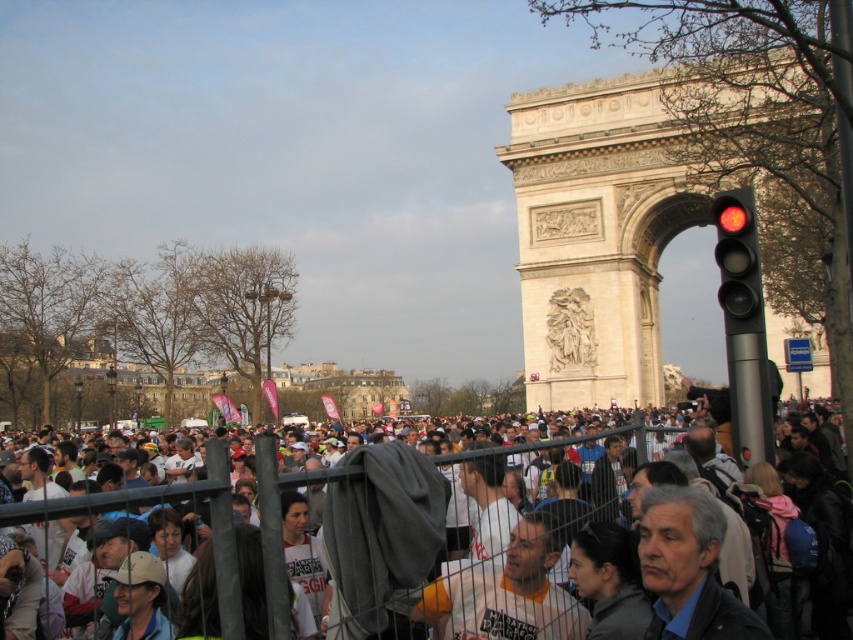
Does white fabric at center have a lesser width compared to red glass traffic light at right?

No, white fabric at center is not thinner than red glass traffic light at right.

Does white fabric at center have a greater height compared to red glass traffic light at right?

Indeed, white fabric at center has a greater height compared to red glass traffic light at right.

Who is more forward, (480, 461) or (737, 285)?

Point (737, 285) is in front.

The image size is (853, 640). Identify the location of white fabric at center. (373, 529).